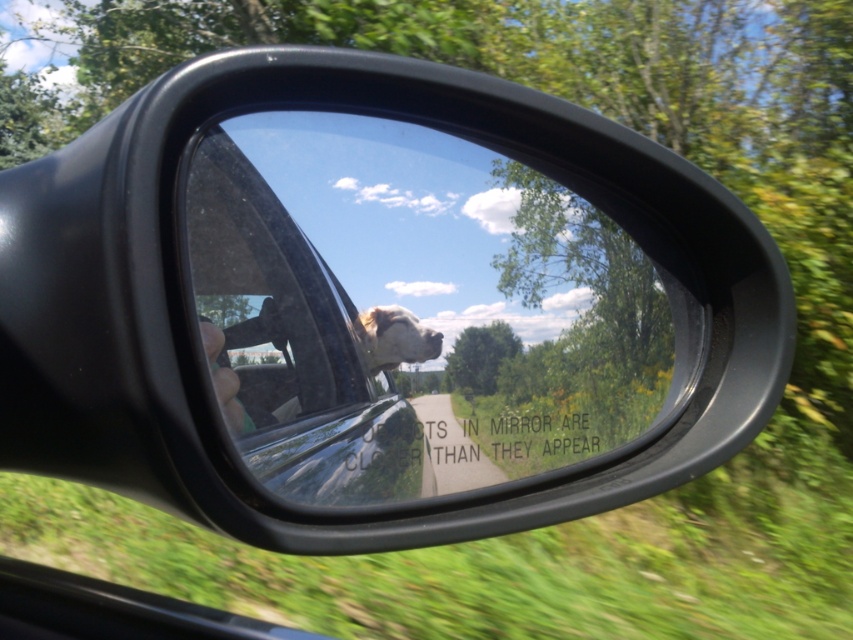
Question: Which of the following is the closest to the observer?

Choices:
 (A) (631, 417)
 (B) (374, 352)

Answer: (B)

Question: Among these points, which one is nearest to the camera?

Choices:
 (A) pos(364,324)
 (B) pos(248,200)

Answer: (B)

Question: In this image, where is clear glass window at center located relative to light brown fur at center?

Choices:
 (A) left
 (B) right

Answer: (B)

Question: Which point is closer to the camera?

Choices:
 (A) (415, 294)
 (B) (401, 346)

Answer: (B)

Question: Does clear glass window at center appear on the left side of light brown fur at center?

Choices:
 (A) no
 (B) yes

Answer: (A)

Question: Does clear glass window at center have a larger size compared to light brown fur at center?

Choices:
 (A) no
 (B) yes

Answer: (B)